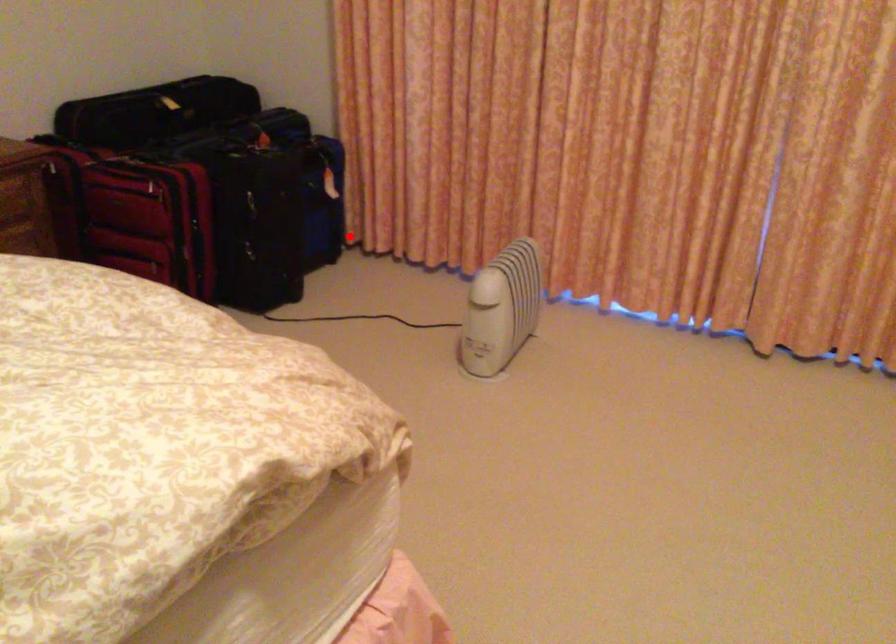
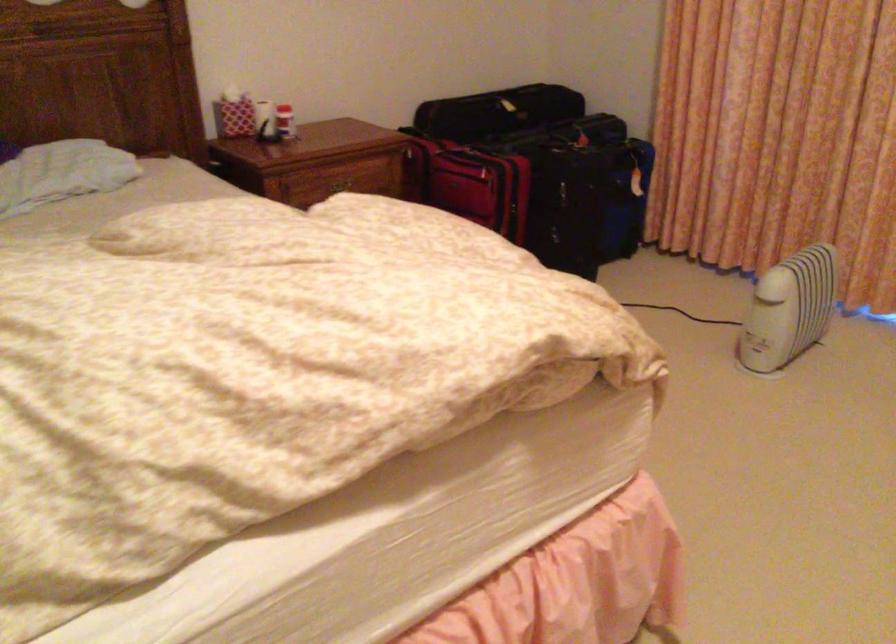
Question: I am providing you with two images of the same scene from different viewpoints. A red point is marked on the first image. At the location where the point appears in image 1, is it still visible in image 2?

Choices:
 (A) Yes
 (B) No

Answer: (A)